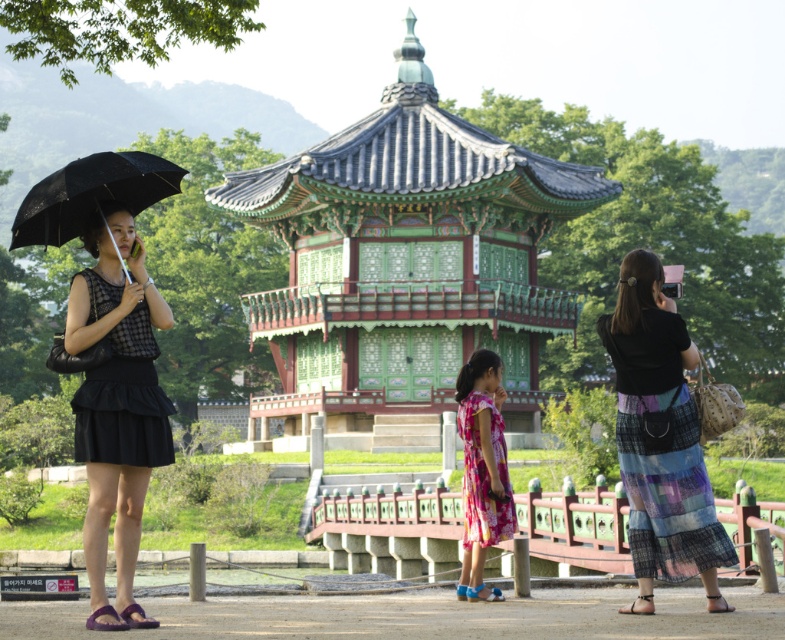
Question: Is multicolored woven skirt at right to the right of floral silk dress at center from the viewer's perspective?

Choices:
 (A) yes
 (B) no

Answer: (A)

Question: Where is green lacquered wood gazebo at center located in relation to black matte umbrella at left in the image?

Choices:
 (A) above
 (B) below

Answer: (A)

Question: Is black matte dress at left thinner than multicolored woven skirt at right?

Choices:
 (A) yes
 (B) no

Answer: (A)

Question: Considering the real-world distances, which object is closest to the multicolored woven skirt at right?

Choices:
 (A) black matte dress at left
 (B) black matte umbrella at left

Answer: (A)

Question: Which point appears farthest from the camera in this image?

Choices:
 (A) (457, 422)
 (B) (552, 198)
 (C) (656, 406)
 (D) (97, 566)

Answer: (B)

Question: Which object appears closest to the camera in this image?

Choices:
 (A) floral silk dress at center
 (B) green lacquered wood gazebo at center
 (C) multicolored woven skirt at right
 (D) black matte dress at left

Answer: (D)